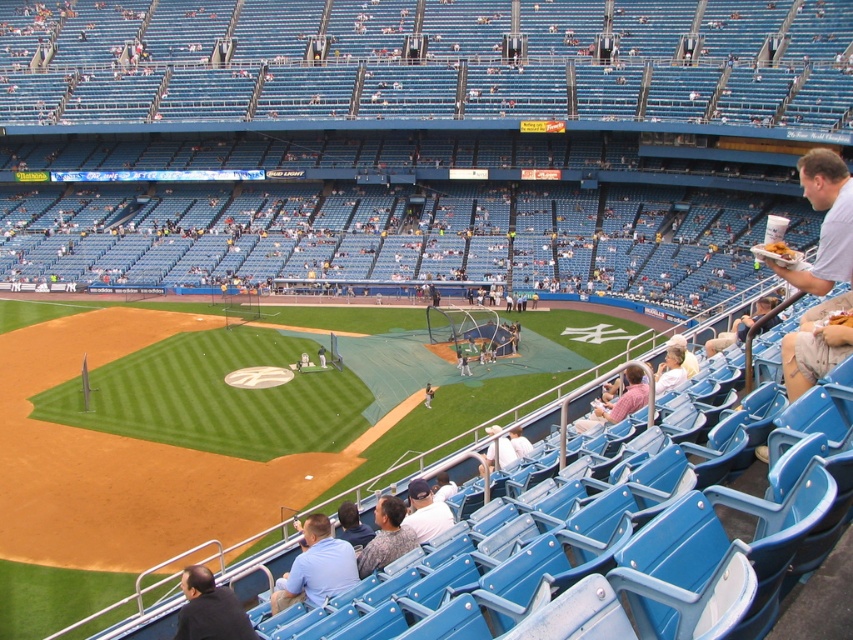
Does blue fabric shirt at lower center have a larger size compared to tan leather glove at center?

Yes.

Is blue fabric shirt at lower center thinner than tan leather glove at center?

No, blue fabric shirt at lower center is not thinner than tan leather glove at center.

Locate an element on the screen. The height and width of the screenshot is (640, 853). blue fabric shirt at lower center is located at coordinates (316, 566).

Between blue fabric shirt at lower center and dark blue shirt at lower left, which one has more height?

blue fabric shirt at lower center is taller.

Can you confirm if blue fabric shirt at lower center is thinner than dark blue shirt at lower left?

No.

Where is `blue fabric shirt at lower center`? Image resolution: width=853 pixels, height=640 pixels. blue fabric shirt at lower center is located at coordinates (316, 566).

Locate an element on the screen. blue fabric shirt at lower center is located at coordinates (316, 566).

Is dark blue shirt at lower left taller than light blue shirt at lower center?

Correct, dark blue shirt at lower left is much taller as light blue shirt at lower center.

How much distance is there between dark blue shirt at lower left and light blue shirt at lower center?

11.31 feet

Image resolution: width=853 pixels, height=640 pixels. Describe the element at coordinates (210, 609) in the screenshot. I see `dark blue shirt at lower left` at that location.

You are a GUI agent. You are given a task and a screenshot of the screen. Output one action in this format:
    pyautogui.click(x=<x>, y=<y>)
    Task: Click on the dark blue shirt at lower left
    This screenshot has height=640, width=853.
    Given the screenshot: What is the action you would take?
    pyautogui.click(x=210, y=609)